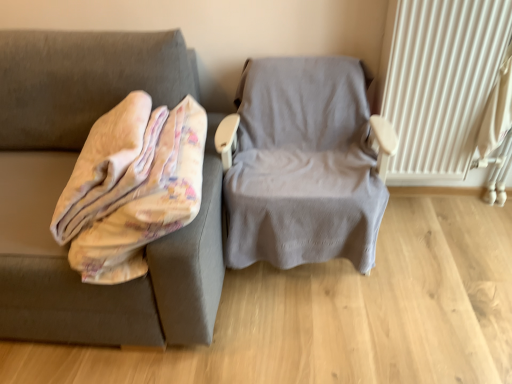
This screenshot has width=512, height=384. I want to click on fluffy beige blanket at left, so click(125, 286).

Image resolution: width=512 pixels, height=384 pixels. Identify the location of radiator positioned vertically above the fluffy beige blanket at left (from a real-world perspective). (439, 81).

Does white textured radiator at right have a greater height compared to fluffy beige blanket at left?

Correct, white textured radiator at right is much taller as fluffy beige blanket at left.

Between white textured radiator at right and fluffy beige blanket at left, which one appears on the left side from the viewer's perspective?

fluffy beige blanket at left.

Is gray fabric chair at center thinner than white textured radiator at right?

Incorrect, the width of gray fabric chair at center is not less than that of white textured radiator at right.

Between gray fabric chair at center and white textured radiator at right, which one has less height?

With less height is gray fabric chair at center.

From the image's perspective, is gray fabric chair at center beneath white textured radiator at right?

Correct, gray fabric chair at center appears lower than white textured radiator at right in the image.

Identify the location of chair that appears in front of the white textured radiator at right. (306, 165).

From their relative heights in the image, would you say fluffy beige blanket at left is taller or shorter than white textured radiator at right?

Clearly, fluffy beige blanket at left is shorter compared to white textured radiator at right.

Considering the relative sizes of fluffy beige blanket at left and white textured radiator at right in the image provided, is fluffy beige blanket at left smaller than white textured radiator at right?

No.

Which is more to the right, fluffy beige blanket at left or white textured radiator at right?

From the viewer's perspective, white textured radiator at right appears more on the right side.

Who is bigger, gray fabric chair at center or fluffy beige blanket at left?

gray fabric chair at center.

From the image's perspective, is gray fabric chair at center located above fluffy beige blanket at left?

Yes, from the image's perspective, gray fabric chair at center is on top of fluffy beige blanket at left.

Is gray fabric chair at center at the left side of fluffy beige blanket at left?

In fact, gray fabric chair at center is to the right of fluffy beige blanket at left.

From their relative heights in the image, would you say gray fabric chair at center is taller or shorter than fluffy beige blanket at left?

Considering their sizes, gray fabric chair at center has more height than fluffy beige blanket at left.

This screenshot has width=512, height=384. I want to click on chair directly beneath the fluffy beige blanket at left (from a real-world perspective), so click(306, 165).

Does fluffy beige blanket at left have a smaller size compared to gray fabric chair at center?

Yes.

Is point (186, 292) positioned before point (273, 158)?

Yes, point (186, 292) is in front of point (273, 158).

From the picture: From a real-world perspective, which object stands above the other?

fluffy beige blanket at left is physically above.

From the image's perspective, is white textured radiator at right positioned above or below gray fabric chair at center?

Clearly, from the image's perspective, white textured radiator at right is above gray fabric chair at center.

Does white textured radiator at right have a lesser height compared to gray fabric chair at center?

Incorrect, the height of white textured radiator at right does not fall short of that of gray fabric chair at center.

From a real-world perspective, is white textured radiator at right physically located above or below gray fabric chair at center?

white textured radiator at right is situated higher than gray fabric chair at center in the real world.

The width and height of the screenshot is (512, 384). I want to click on radiator on the right side of fluffy beige blanket at left, so click(x=439, y=81).

Identify the location of radiator above the gray fabric chair at center (from the image's perspective). (439, 81).

Estimate the real-world distances between objects in this image. Which object is further from fluffy beige blanket at left, white textured radiator at right or gray fabric chair at center?

Based on the image, white textured radiator at right appears to be further to fluffy beige blanket at left.

Estimate the real-world distances between objects in this image. Which object is closer to white textured radiator at right, fluffy beige blanket at left or gray fabric chair at center?

gray fabric chair at center lies closer to white textured radiator at right than the other object.

When comparing their distances from gray fabric chair at center, does fluffy beige blanket at left or white textured radiator at right seem closer?

Among the two, white textured radiator at right is located nearer to gray fabric chair at center.

Considering their positions, is gray fabric chair at center positioned closer to fluffy beige blanket at left than white textured radiator at right?

gray fabric chair at center is closer to fluffy beige blanket at left.

Based on the photo, considering their positions, is white textured radiator at right positioned further to gray fabric chair at center than fluffy beige blanket at left?

fluffy beige blanket at left.

When comparing their distances from white textured radiator at right, does gray fabric chair at center or fluffy beige blanket at left seem further?

fluffy beige blanket at left is further to white textured radiator at right.

In order to click on chair situated between fluffy beige blanket at left and white textured radiator at right from left to right in this screenshot , I will do pyautogui.click(x=306, y=165).